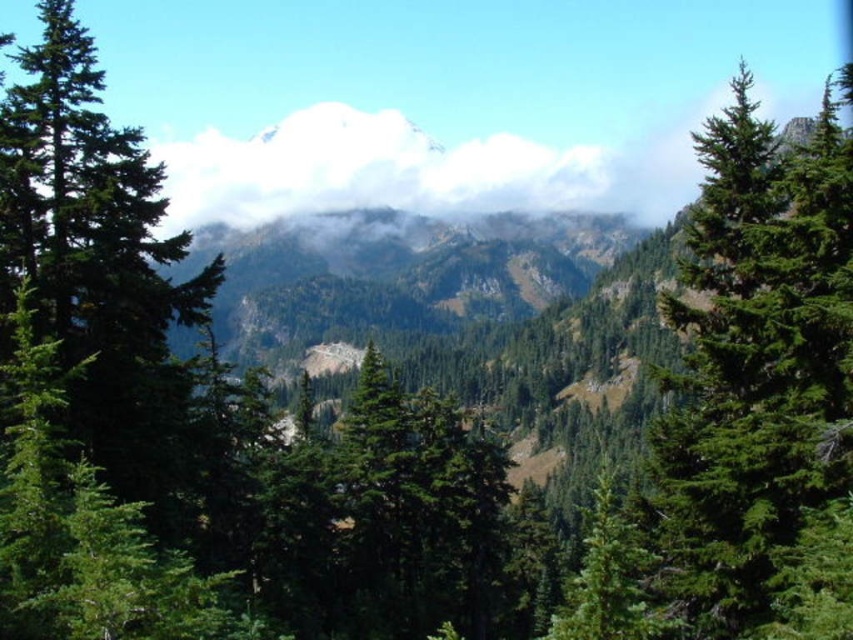
Question: Among these objects, which one is nearest to the camera?

Choices:
 (A) white fluffy cloud at center
 (B) green needle-like tree at right

Answer: (B)

Question: Is green needle-like tree at right positioned in front of white fluffy cloud at center?

Choices:
 (A) yes
 (B) no

Answer: (A)

Question: Can you confirm if green needle-like tree at right is smaller than white fluffy cloud at center?

Choices:
 (A) no
 (B) yes

Answer: (B)

Question: Considering the relative positions of green needle-like tree at right and white fluffy cloud at center in the image provided, where is green needle-like tree at right located with respect to white fluffy cloud at center?

Choices:
 (A) below
 (B) above

Answer: (A)

Question: Which object appears closest to the camera in this image?

Choices:
 (A) white fluffy cloud at center
 (B) green needle-like tree at right

Answer: (B)